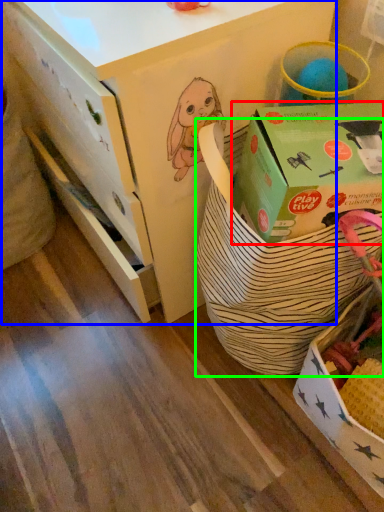
Question: Which object is the closest to the box (highlighted by a red box)? Choose among these: desk (highlighted by a blue box) or gift basket (highlighted by a green box).

Choices:
 (A) desk
 (B) gift basket

Answer: (B)